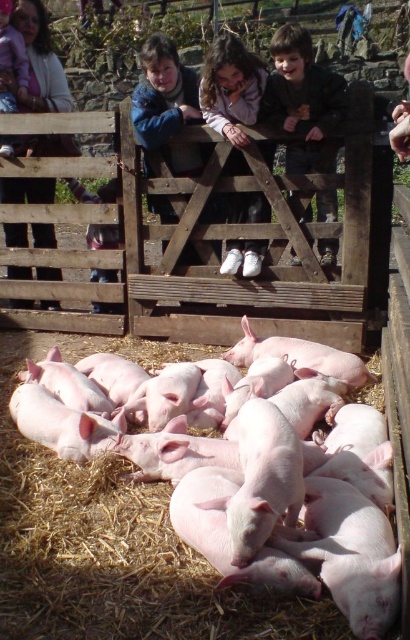
Is dark brown hair at upper center closer to camera compared to white sneakers at upper center?

Yes.

Between dark brown hair at upper center and white sneakers at upper center, which one is positioned higher?

Positioned higher is white sneakers at upper center.

Between point (311, 38) and point (250, 108), which one is positioned in front?

Point (250, 108) is in front.

The height and width of the screenshot is (640, 410). In order to click on dark brown hair at upper center in this screenshot , I will do `click(302, 100)`.

From the picture: Is the position of dark brown hair at upper center less distant than that of pink fabric at upper left?

Yes, dark brown hair at upper center is in front of pink fabric at upper left.

Between dark brown hair at upper center and pink fabric at upper left, which one has more height?

dark brown hair at upper center

What do you see at coordinates (302, 100) in the screenshot?
I see `dark brown hair at upper center` at bounding box center [302, 100].

I want to click on dark brown hair at upper center, so click(302, 100).

Does white sneakers at upper center appear under pink fabric at upper left?

Yes, white sneakers at upper center is below pink fabric at upper left.

Does white sneakers at upper center have a lesser height compared to pink fabric at upper left?

Yes.

Where is `white sneakers at upper center`? white sneakers at upper center is located at coordinates (232, 93).